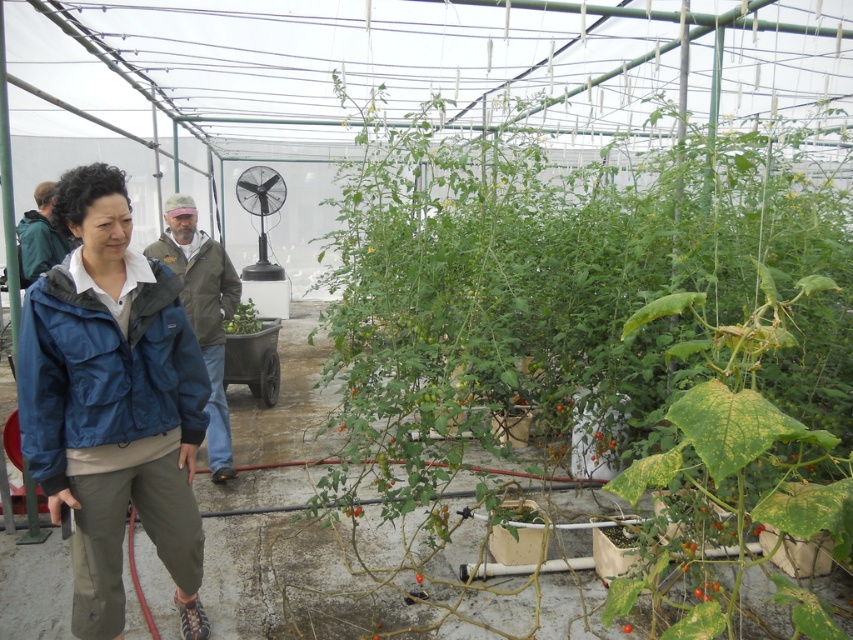
You are standing in the greenhouse and notice two green items. One is the green matte jacket at left and the other is the green matte plant at center. Which one is higher up in the scene?

The green matte jacket at left is located above the green matte plant at center, so the green matte jacket at left is higher up in the scene.

Based on the scene description, where is the green matte jacket at left located in the image?

The green matte jacket at left is located at the 2D coordinates point (39,236) in the image.